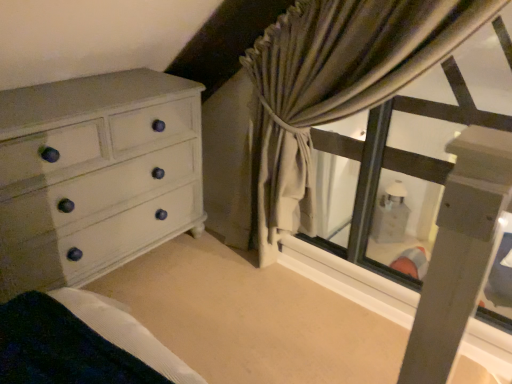
Identify the location of white painted wood chest of drawers at left. Image resolution: width=512 pixels, height=384 pixels. (95, 175).

Describe the element at coordinates (95, 175) in the screenshot. The image size is (512, 384). I see `white painted wood chest of drawers at left` at that location.

The width and height of the screenshot is (512, 384). Describe the element at coordinates (334, 87) in the screenshot. I see `textured beige curtain at upper right` at that location.

This screenshot has height=384, width=512. What are the coordinates of `textured beige curtain at upper right` in the screenshot? It's located at (334, 87).

The height and width of the screenshot is (384, 512). What are the coordinates of `white painted wood chest of drawers at left` in the screenshot? It's located at (95, 175).

Considering the positions of objects white painted wood chest of drawers at left and textured beige curtain at upper right in the image provided, who is more to the left, white painted wood chest of drawers at left or textured beige curtain at upper right?

From the viewer's perspective, white painted wood chest of drawers at left appears more on the left side.

In the scene shown: Who is more distant, white painted wood chest of drawers at left or textured beige curtain at upper right?

Positioned behind is white painted wood chest of drawers at left.

Which point is more distant from viewer, (162,173) or (366,15)?

Point (162,173)

From the image's perspective, is white painted wood chest of drawers at left on top of textured beige curtain at upper right?

No, from the image's perspective, white painted wood chest of drawers at left is not over textured beige curtain at upper right.

From a real-world perspective, which object rests below the other?

white painted wood chest of drawers at left, from a real-world perspective.

Is white painted wood chest of drawers at left wider than textured beige curtain at upper right?

Yes.

In terms of height, does white painted wood chest of drawers at left look taller or shorter compared to textured beige curtain at upper right?

white painted wood chest of drawers at left is shorter than textured beige curtain at upper right.

Who is bigger, white painted wood chest of drawers at left or textured beige curtain at upper right?

white painted wood chest of drawers at left is bigger.

Can we say white painted wood chest of drawers at left lies outside textured beige curtain at upper right?

white painted wood chest of drawers at left lies outside textured beige curtain at upper right's area.

Is white painted wood chest of drawers at left positioned far away from textured beige curtain at upper right?

Actually, white painted wood chest of drawers at left and textured beige curtain at upper right are a little close together.

Consider the image. Is white painted wood chest of drawers at left positioned with its back to textured beige curtain at upper right?

No, white painted wood chest of drawers at left is not facing away from textured beige curtain at upper right.

Can you tell me how much white painted wood chest of drawers at left and textured beige curtain at upper right differ in facing direction?

The facing directions of white painted wood chest of drawers at left and textured beige curtain at upper right are 97.1 degrees apart.

Where is `the chest of drawers that is below the textured beige curtain at upper right (from the image's perspective)`? The width and height of the screenshot is (512, 384). the chest of drawers that is below the textured beige curtain at upper right (from the image's perspective) is located at coordinates (95, 175).

Can you confirm if textured beige curtain at upper right is positioned to the right of white painted wood chest of drawers at left?

Yes, textured beige curtain at upper right is to the right of white painted wood chest of drawers at left.

Is textured beige curtain at upper right in front of or behind white painted wood chest of drawers at left in the image?

textured beige curtain at upper right is in front of white painted wood chest of drawers at left.

Does point (288, 198) lie in front of point (66, 234)?

No, it is not.

From the image's perspective, is textured beige curtain at upper right on top of white painted wood chest of drawers at left?

Yes.

From a real-world perspective, is textured beige curtain at upper right on white painted wood chest of drawers at left?

Yes, from a real-world perspective, textured beige curtain at upper right is over white painted wood chest of drawers at left

Is textured beige curtain at upper right thinner than white painted wood chest of drawers at left?

Yes.

Is textured beige curtain at upper right taller or shorter than white painted wood chest of drawers at left?

In the image, textured beige curtain at upper right appears to be taller than white painted wood chest of drawers at left.

Does textured beige curtain at upper right have a larger size compared to white painted wood chest of drawers at left?

No, textured beige curtain at upper right is not bigger than white painted wood chest of drawers at left.

Is white painted wood chest of drawers at left completely or partially inside textured beige curtain at upper right?

No, textured beige curtain at upper right does not contain white painted wood chest of drawers at left.

Is textured beige curtain at upper right positioned far away from white painted wood chest of drawers at left?

They are positioned close to each other.

Is white painted wood chest of drawers at left at the back of textured beige curtain at upper right?

No, textured beige curtain at upper right's orientation is not away from white painted wood chest of drawers at left.

Locate an element on the screen. the chest of drawers below the textured beige curtain at upper right (from the image's perspective) is located at coordinates (95, 175).

Where is `curtain located in front of the white painted wood chest of drawers at left`? The image size is (512, 384). curtain located in front of the white painted wood chest of drawers at left is located at coordinates (334, 87).

Where is `curtain on the right of white painted wood chest of drawers at left`? This screenshot has height=384, width=512. curtain on the right of white painted wood chest of drawers at left is located at coordinates pyautogui.click(x=334, y=87).